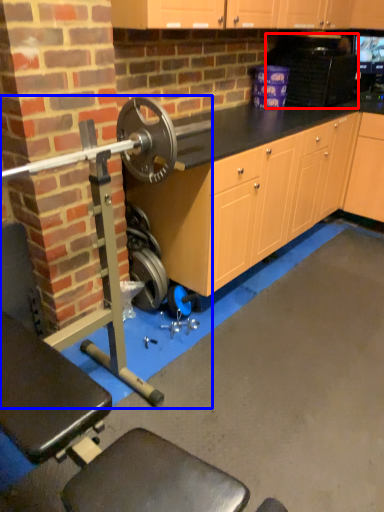
Question: Which of the following is the farthest to the observer, appliance (highlighted by a red box) or barbell (highlighted by a blue box)?

Choices:
 (A) appliance
 (B) barbell

Answer: (A)